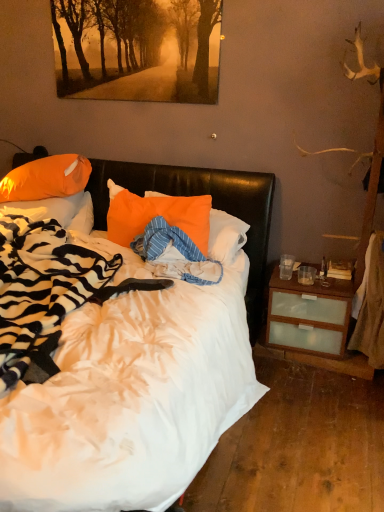
Question: From the image's perspective, is white soft bed at center beneath orange glossy pillow at upper left, acting as the 2th pillow starting from the right?

Choices:
 (A) no
 (B) yes

Answer: (B)

Question: Can we say white soft bed at center lies outside orange glossy pillow at upper left, which is the second pillow in left-to-right order?

Choices:
 (A) no
 (B) yes

Answer: (B)

Question: Would you say white soft bed at center is a long distance from orange glossy pillow at upper left, which is the second pillow in left-to-right order?

Choices:
 (A) no
 (B) yes

Answer: (B)

Question: Can you confirm if white soft bed at center is wider than orange glossy pillow at upper left, which is the second pillow in left-to-right order?

Choices:
 (A) yes
 (B) no

Answer: (A)

Question: Can you confirm if white soft bed at center is positioned to the right of orange glossy pillow at upper left, acting as the 2th pillow starting from the right?

Choices:
 (A) yes
 (B) no

Answer: (A)

Question: From a real-world perspective, does white soft bed at center stand above orange glossy pillow at upper left, which is the second pillow in left-to-right order?

Choices:
 (A) no
 (B) yes

Answer: (A)

Question: Is there a large distance between orange fabric pillow at center, the 3th pillow viewed from the left, and golden textured pathway at upper center?

Choices:
 (A) yes
 (B) no

Answer: (B)

Question: Considering the relative sizes of orange fabric pillow at center, the 3th pillow viewed from the left, and golden textured pathway at upper center in the image provided, is orange fabric pillow at center, the 3th pillow viewed from the left, thinner than golden textured pathway at upper center?

Choices:
 (A) yes
 (B) no

Answer: (B)

Question: Is orange fabric pillow at center, the 3th pillow viewed from the left, at the left side of golden textured pathway at upper center?

Choices:
 (A) no
 (B) yes

Answer: (A)

Question: From the image's perspective, does orange fabric pillow at center, the first pillow when ordered from right to left, appear lower than golden textured pathway at upper center?

Choices:
 (A) yes
 (B) no

Answer: (A)

Question: Can you confirm if orange fabric pillow at center, the first pillow when ordered from right to left, is bigger than golden textured pathway at upper center?

Choices:
 (A) yes
 (B) no

Answer: (A)

Question: Does orange fabric pillow at center, the first pillow when ordered from right to left, touch golden textured pathway at upper center?

Choices:
 (A) no
 (B) yes

Answer: (A)

Question: Is orange glossy pillow at upper left, acting as the 2th pillow starting from the right, oriented away from orange fabric pillow at center, the first pillow when ordered from right to left?

Choices:
 (A) no
 (B) yes

Answer: (A)